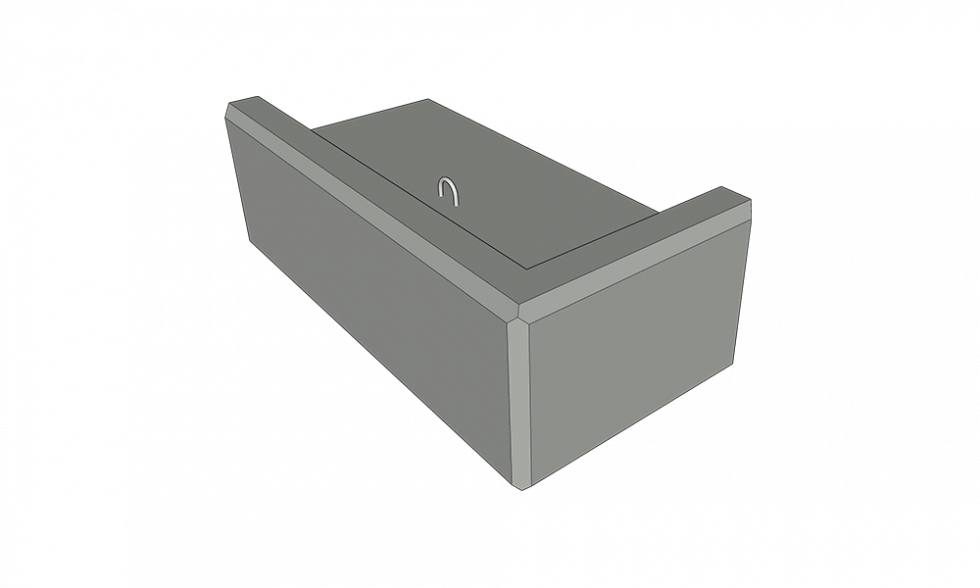
Find the location of a particular element. The image size is (980, 588). table is located at coordinates (497, 185).